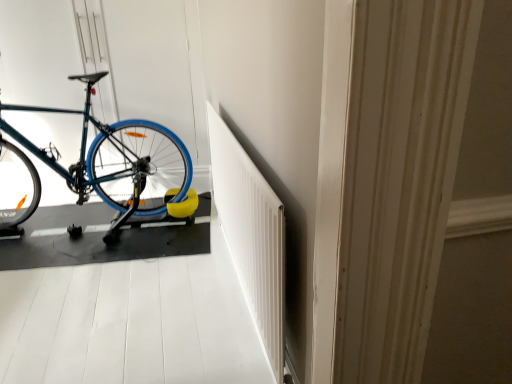
I want to click on white textured radiator at center, so click(251, 235).

This screenshot has height=384, width=512. What do you see at coordinates (251, 235) in the screenshot?
I see `white textured radiator at center` at bounding box center [251, 235].

Where is `white textured radiator at center`? Image resolution: width=512 pixels, height=384 pixels. white textured radiator at center is located at coordinates (251, 235).

In the scene shown: Is blue rubber bike at left in contact with teal matte bicycle at left?

blue rubber bike at left and teal matte bicycle at left are not in contact.

Between blue rubber bike at left and teal matte bicycle at left, which one has smaller width?

teal matte bicycle at left.

Measure the distance between blue rubber bike at left and teal matte bicycle at left.

37.01 inches.

Is blue rubber bike at left positioned with its back to teal matte bicycle at left?

No, blue rubber bike at left is not facing away from teal matte bicycle at left.

Can you confirm if teal matte bicycle at left is taller than blue rubber bike at left?

Correct, teal matte bicycle at left is much taller as blue rubber bike at left.

Does point (106, 153) come in front of point (51, 287)?

That is False.

Looking at this image, does teal matte bicycle at left come in front of blue rubber bike at left?

That is False.

Could you tell me if blue rubber bike at left is turned towards white textured radiator at center?

No.

What's the angular difference between blue rubber bike at left and white textured radiator at center's facing directions?

There is a 89-degree angle between the facing directions of blue rubber bike at left and white textured radiator at center.

Is blue rubber bike at left with white textured radiator at center?

No, blue rubber bike at left is not touching white textured radiator at center.

Is blue rubber bike at left outside of white textured radiator at center?

Yes, blue rubber bike at left is not within white textured radiator at center.

Considering the sizes of teal matte bicycle at left and white textured radiator at center in the image, is teal matte bicycle at left bigger or smaller than white textured radiator at center?

Clearly, teal matte bicycle at left is larger in size than white textured radiator at center.

Is teal matte bicycle at left with white textured radiator at center?

They are not placed beside each other.

Can you confirm if teal matte bicycle at left is taller than white textured radiator at center?

Yes, teal matte bicycle at left is taller than white textured radiator at center.

From a real-world perspective, who is located lower, white textured radiator at center or teal matte bicycle at left?

white textured radiator at center is physically lower.

What are the coordinates of `bicycle above the white textured radiator at center (from the image's perspective)` in the screenshot? It's located at (119, 160).

In the scene shown: Can you tell me how much white textured radiator at center and teal matte bicycle at left differ in facing direction?

white textured radiator at center and teal matte bicycle at left are facing 11.7 degrees away from each other.

Consider the image. Which object is positioned more to the left, white textured radiator at center or teal matte bicycle at left?

teal matte bicycle at left is more to the left.

Which is more to the left, white textured radiator at center or blue rubber bike at left?

blue rubber bike at left is more to the left.

Is point (251, 266) positioned in front of point (39, 339)?

Yes.

Does white textured radiator at center turn towards blue rubber bike at left?

Yes.

The width and height of the screenshot is (512, 384). I want to click on bicycle that is above the blue rubber bike at left (from a real-world perspective), so click(x=119, y=160).

The width and height of the screenshot is (512, 384). In order to click on path below the teal matte bicycle at left (from the image's perspective) in this screenshot , I will do pos(129,324).

Which object lies further to the anchor point blue rubber bike at left, white textured radiator at center or teal matte bicycle at left?

teal matte bicycle at left.

Estimate the real-world distances between objects in this image. Which object is closer to white textured radiator at center, teal matte bicycle at left or blue rubber bike at left?

The object closer to white textured radiator at center is blue rubber bike at left.

Looking at this image, which object lies further to the anchor point blue rubber bike at left, teal matte bicycle at left or white textured radiator at center?

Among the two, teal matte bicycle at left is located further to blue rubber bike at left.

Based on their spatial positions, is white textured radiator at center or blue rubber bike at left further from teal matte bicycle at left?

white textured radiator at center.

From the image, which object appears to be farther from white textured radiator at center, blue rubber bike at left or teal matte bicycle at left?

teal matte bicycle at left is further to white textured radiator at center.

Estimate the real-world distances between objects in this image. Which object is further from teal matte bicycle at left, blue rubber bike at left or white textured radiator at center?

white textured radiator at center is further to teal matte bicycle at left.

At what (x,y) coordinates should I click in order to perform the action: click on path between white textured radiator at center and teal matte bicycle at left along the z-axis. Please return your answer as a coordinate pair (x, y). The width and height of the screenshot is (512, 384). Looking at the image, I should click on (129, 324).